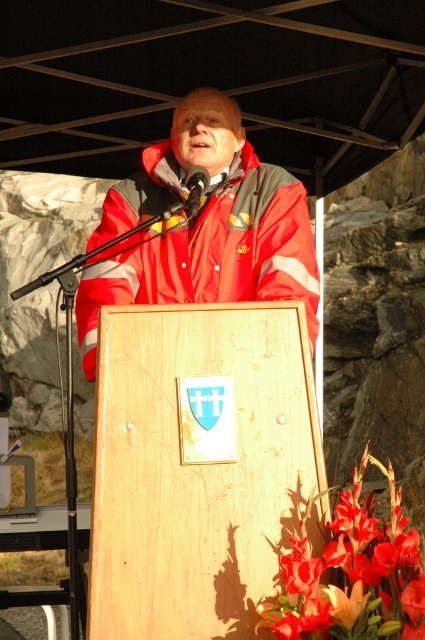
Question: Which object is closer to the camera taking this photo?

Choices:
 (A) red matte jacket at center
 (B) vivid red petals at lower right
 (C) metallic black microphone at center

Answer: (B)

Question: Considering the real-world distances, which object is closest to the red matte jacket at center?

Choices:
 (A) metallic black microphone at center
 (B) vivid red petals at lower right

Answer: (A)

Question: Is vivid red petals at lower right wider than metallic black microphone at center?

Choices:
 (A) yes
 (B) no

Answer: (A)

Question: Which point is farther to the camera?

Choices:
 (A) vivid red petals at lower right
 (B) metallic black microphone at center
 (C) red matte jacket at center

Answer: (B)

Question: Does red matte jacket at center have a lesser width compared to metallic black microphone at center?

Choices:
 (A) yes
 (B) no

Answer: (B)

Question: Can you confirm if red matte jacket at center is wider than metallic black microphone at center?

Choices:
 (A) no
 (B) yes

Answer: (B)